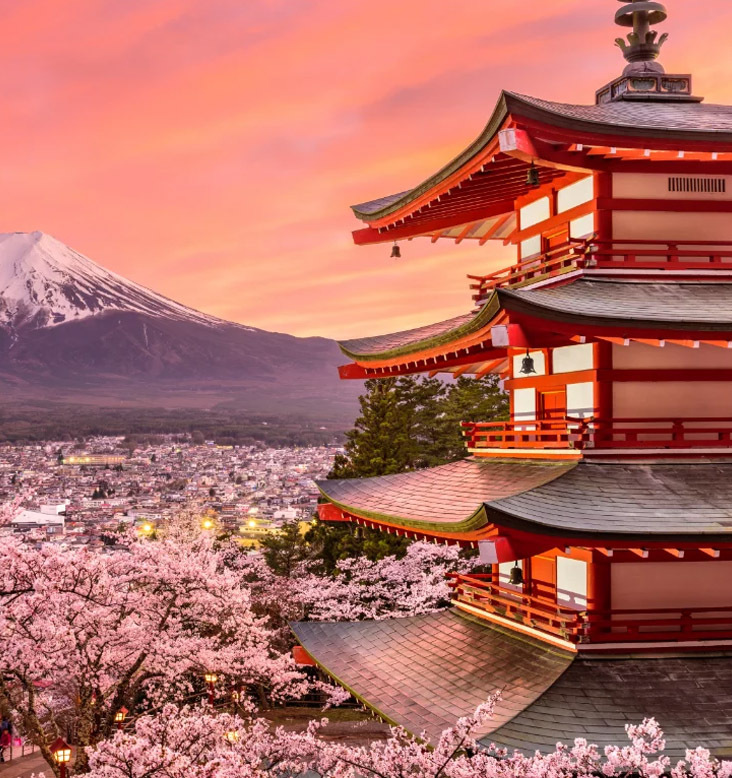
The height and width of the screenshot is (778, 732). I want to click on window, so click(553, 228), click(555, 395), click(541, 573).